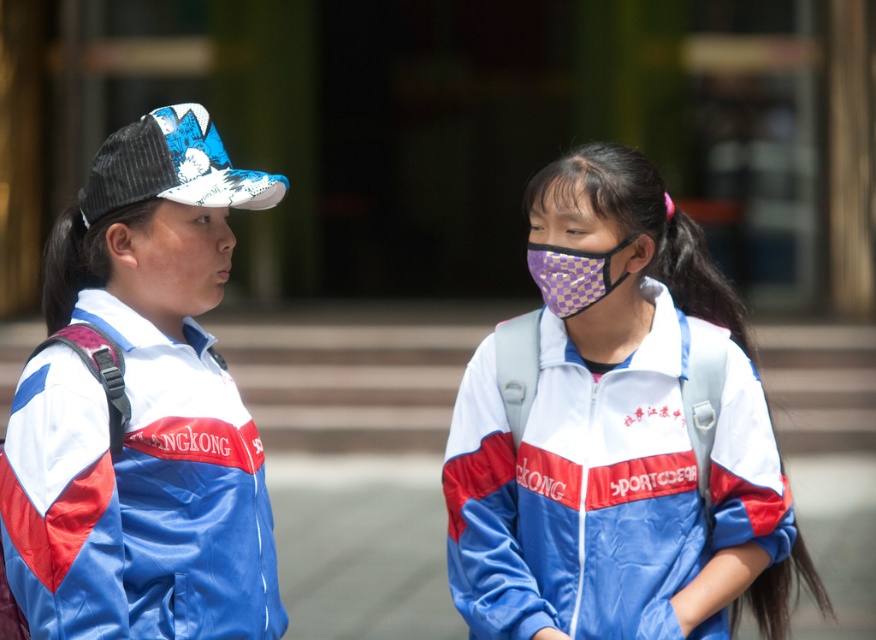
You are standing in front of a school entrance wearing a camera that can zoom in. You see the purple checkered fabric mask at center. Can your camera capture the mask clearly without zooming in?

The purple checkered fabric mask at center is 5.49 meters away from viewer. Since it is more than 5 meters away, you might need to zoom in to capture it clearly.

You are a photographer trying to capture both the matte blue jacket at left and the purple checkered mask at center in a single frame. Based on their sizes, will you need to adjust your camera angle to ensure both are fully visible?

The matte blue jacket at left might be wider than the purple checkered mask at center, so adjusting the camera angle to accommodate the wider object could help ensure both are fully visible in the frame.

You are a photographer trying to capture a clear shot of both the matte blue jacket at left and the purple checkered mask at center. Since you want both subjects in focus, which object should you adjust your camera focus to prioritize first?

The matte blue jacket at left is closer to the viewer than the purple checkered mask at center, so you should focus on the matte blue jacket at left first to ensure both are in focus.